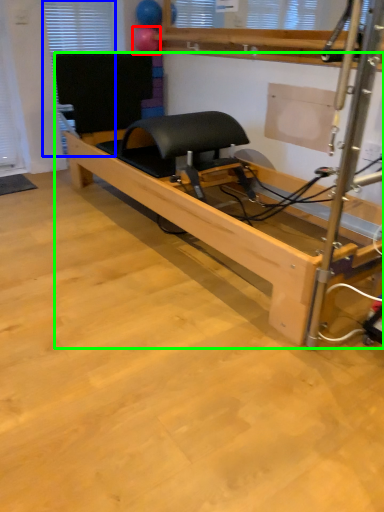
Question: Estimate the real-world distances between objects in this image. Which object is closer to balloon (highlighted by a red box), window (highlighted by a blue box) or furniture (highlighted by a green box)?

Choices:
 (A) window
 (B) furniture

Answer: (A)